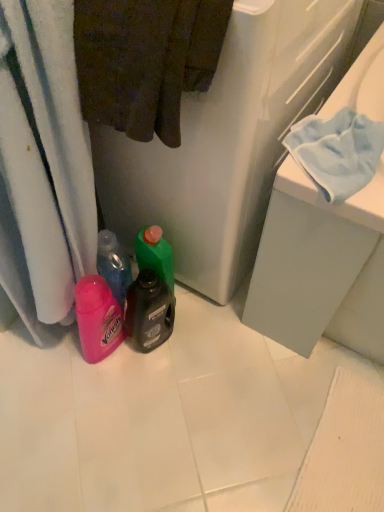
Locate an element on the screen. The height and width of the screenshot is (512, 384). brown cotton towel at upper left is located at coordinates (145, 61).

Describe the element at coordinates (145, 61) in the screenshot. This screenshot has width=384, height=512. I see `brown cotton towel at upper left` at that location.

What do you see at coordinates (227, 140) in the screenshot?
I see `white plastic laundry at center` at bounding box center [227, 140].

This screenshot has height=512, width=384. Find the location of `white plastic laundry at center`. white plastic laundry at center is located at coordinates (227, 140).

Where is `brown cotton towel at upper left`? The image size is (384, 512). brown cotton towel at upper left is located at coordinates (145, 61).

Between white plastic laundry at center and brown cotton towel at upper left, which one appears on the left side from the viewer's perspective?

brown cotton towel at upper left.

Between white plastic laundry at center and brown cotton towel at upper left, which one is positioned behind?

white plastic laundry at center is more distant.

Considering the positions of points (238, 210) and (145, 24), is point (238, 210) farther from camera compared to point (145, 24)?

Yes, it is.

From the image's perspective, is white plastic laundry at center on brown cotton towel at upper left?

Correct, white plastic laundry at center appears higher than brown cotton towel at upper left in the image.

From a real-world perspective, which is physically above, white plastic laundry at center or brown cotton towel at upper left?

From a 3D spatial view, brown cotton towel at upper left is above.

Between white plastic laundry at center and brown cotton towel at upper left, which one has larger width?

Wider between the two is white plastic laundry at center.

Who is shorter, white plastic laundry at center or brown cotton towel at upper left?

With less height is brown cotton towel at upper left.

Considering the relative sizes of white plastic laundry at center and brown cotton towel at upper left in the image provided, is white plastic laundry at center bigger than brown cotton towel at upper left?

Correct, white plastic laundry at center is larger in size than brown cotton towel at upper left.

Is brown cotton towel at upper left surrounded by white plastic laundry at center?

Yes, brown cotton towel at upper left is a part of white plastic laundry at center.

Is white plastic laundry at center in contact with brown cotton towel at upper left?

No, white plastic laundry at center is not in contact with brown cotton towel at upper left.

From the picture: Is white plastic laundry at center oriented away from brown cotton towel at upper left?

white plastic laundry at center is not turned away from brown cotton towel at upper left.

At what (x,y) coordinates should I click in order to perform the action: click on bath towel in front of the white plastic laundry at center. Please return your answer as a coordinate pair (x, y). Looking at the image, I should click on (145, 61).

Is brown cotton towel at upper left to the left of white plastic laundry at center from the viewer's perspective?

Yes, brown cotton towel at upper left is to the left of white plastic laundry at center.

Does brown cotton towel at upper left come in front of white plastic laundry at center?

That is True.

Which is closer, (97, 83) or (334, 69)?

The point (97, 83) is closer.

From the image's perspective, between brown cotton towel at upper left and white plastic laundry at center, who is located below?

brown cotton towel at upper left.

From a real-world perspective, between brown cotton towel at upper left and white plastic laundry at center, who is vertically higher?

From a 3D spatial view, brown cotton towel at upper left is above.

Looking at their sizes, would you say brown cotton towel at upper left is wider or thinner than white plastic laundry at center?

Clearly, brown cotton towel at upper left has less width compared to white plastic laundry at center.

Considering the sizes of objects brown cotton towel at upper left and white plastic laundry at center in the image provided, who is taller, brown cotton towel at upper left or white plastic laundry at center?

white plastic laundry at center.

Does brown cotton towel at upper left have a larger size compared to white plastic laundry at center?

Incorrect, brown cotton towel at upper left is not larger than white plastic laundry at center.

Does brown cotton towel at upper left contain white plastic laundry at center?

That's incorrect, white plastic laundry at center is not inside brown cotton towel at upper left.

Consider the image. Are brown cotton towel at upper left and white plastic laundry at center beside each other?

No, brown cotton towel at upper left is not making contact with white plastic laundry at center.

Is brown cotton towel at upper left oriented towards white plastic laundry at center?

Yes, brown cotton towel at upper left is aimed at white plastic laundry at center.

How many degrees apart are the facing directions of brown cotton towel at upper left and white plastic laundry at center?

The facing directions of brown cotton towel at upper left and white plastic laundry at center are 3.63e-05 degrees apart.

Find the location of `appliance lying above the brown cotton towel at upper left (from the image's perspective)`. appliance lying above the brown cotton towel at upper left (from the image's perspective) is located at coordinates (227, 140).

The image size is (384, 512). I want to click on appliance above the brown cotton towel at upper left (from the image's perspective), so click(x=227, y=140).

At what (x,y) coordinates should I click in order to perform the action: click on bath towel in front of the white plastic laundry at center. Please return your answer as a coordinate pair (x, y). The image size is (384, 512). Looking at the image, I should click on (145, 61).